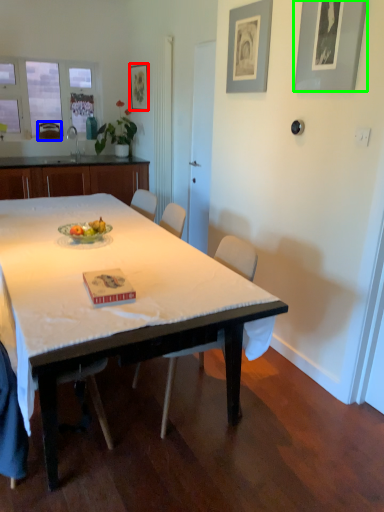
Question: Estimate the real-world distances between objects in this image. Which object is farther from picture frame (highlighted by a red box), chair (highlighted by a blue box) or picture frame (highlighted by a green box)?

Choices:
 (A) chair
 (B) picture frame

Answer: (B)